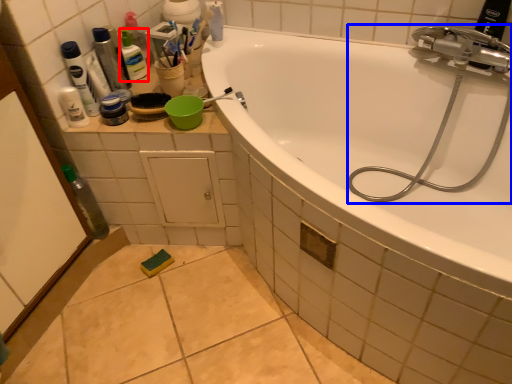
Question: Which of the following is the farthest to the observer, toiletry (highlighted by a red box) or garden hose (highlighted by a blue box)?

Choices:
 (A) toiletry
 (B) garden hose

Answer: (A)